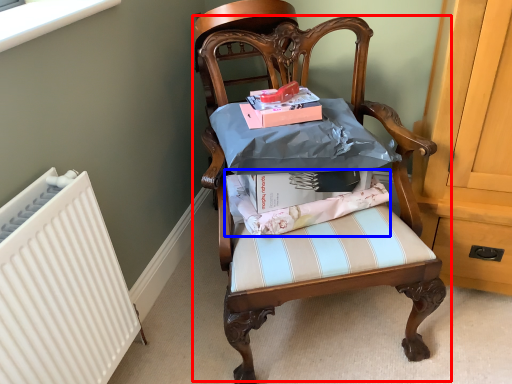
Question: Which object is further to the camera taking this photo, chair (highlighted by a red box) or fabric (highlighted by a blue box)?

Choices:
 (A) chair
 (B) fabric

Answer: (B)